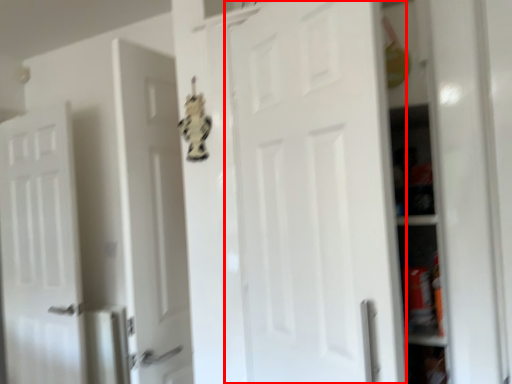
Question: Observing the image, what is the correct spatial positioning of door (annotated by the red box) in reference to door?

Choices:
 (A) left
 (B) right

Answer: (B)